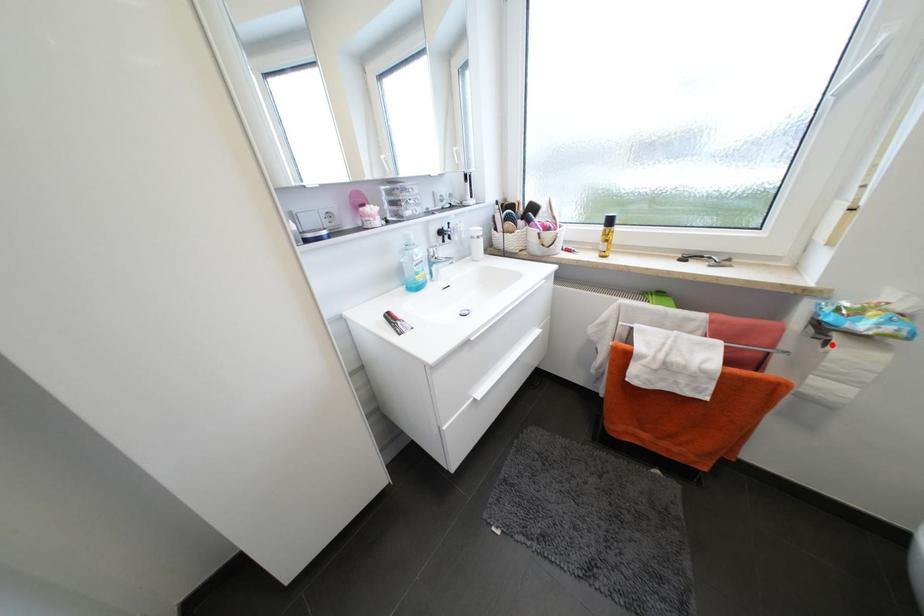
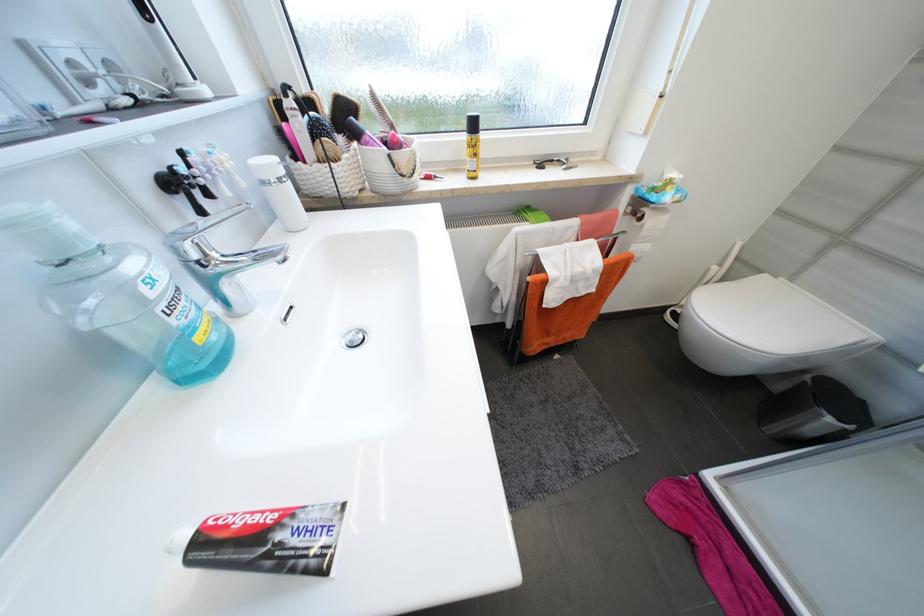
Question: A red point is marked in image1. In image2, is the corresponding 3D point closer to the camera or farther? Reply with the corresponding letter.

Choices:
 (A) The corresponding 3D point is closer.
 (B) The corresponding 3D point is farther.

Answer: (A)